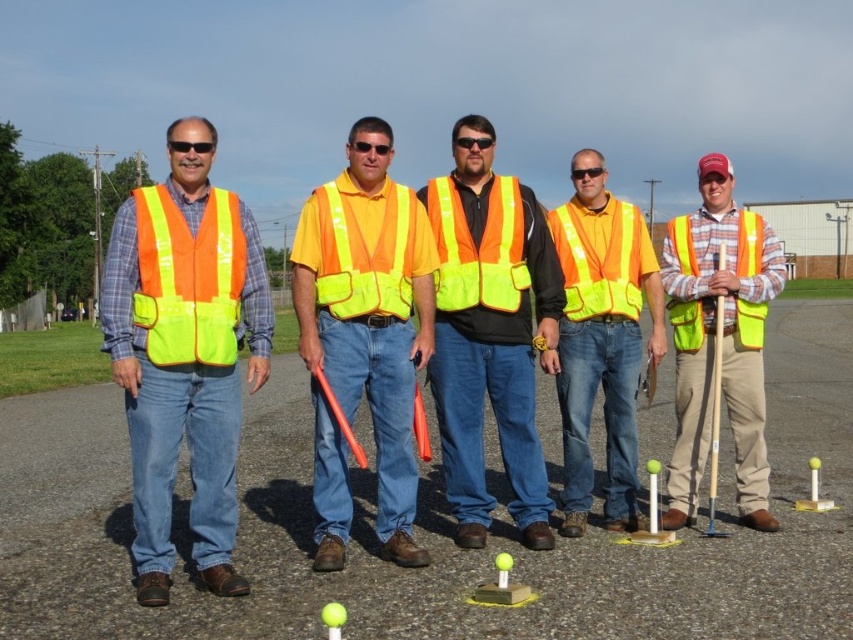
You are standing in front of the group of workers and want to take a photo. You notice two points marked in the scene at coordinates point (424, 548) and point (695, 304). Which point is nearer to you?

Point (424, 548) is closer to the camera than point (695, 304), so the point nearer to you is point (424, 548).